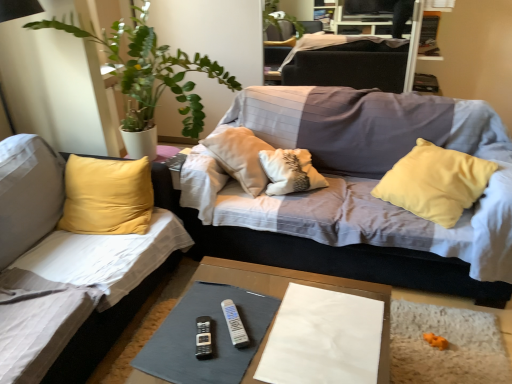
Locate an element on the screen. The height and width of the screenshot is (384, 512). free point behind black plastic remote at center, which is the second remote from right to left is located at coordinates (212, 302).